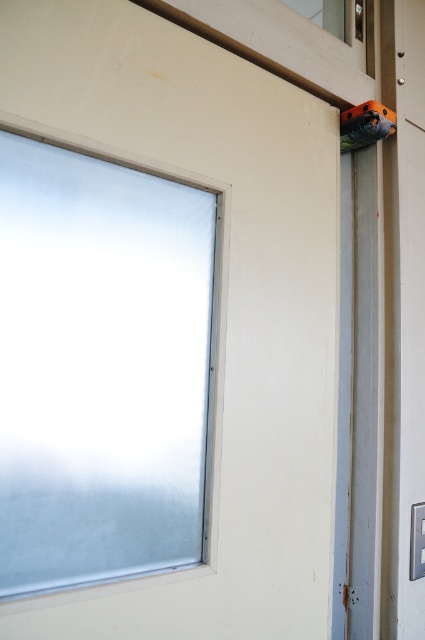
You are a painter who needs to cover the frosted glass window at upper left and the orange plastic drill at upper right with protective covers. If you have a single cover that can only fit over the smaller object, which object should you use it on?

The orange plastic drill at upper right is smaller than the frosted glass window at upper left, so you should use the cover on the orange plastic drill at upper right.

You are examining a door and need to determine the position of two points marked on it. The points are labeled as point (96, 464) and point (342, 150). Which point is closer to you?

Point (96, 464) is closer to the viewer than point (342, 150).

You are standing in front of the door shown in the image. There is a point marked at coordinates (102, 368). What object is located at that point?

The point at coordinates (102, 368) marks the frosted glass window at upper left.